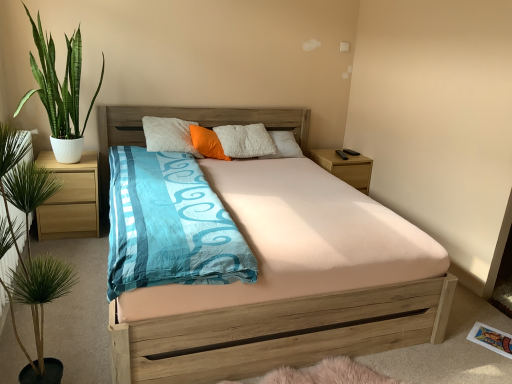
Question: Is green leafy plant at left, which appears as the first houseplant when viewed from the front, positioned with its back to green glossy plant at left, the second houseplant when ordered from bottom to top?

Choices:
 (A) yes
 (B) no

Answer: (B)

Question: Does green leafy plant at left, which ranks as the 1th houseplant in bottom-to-top order, come in front of green glossy plant at left, marked as the 2th houseplant in a front-to-back arrangement?

Choices:
 (A) no
 (B) yes

Answer: (B)

Question: Does green leafy plant at left, which ranks as the 1th houseplant in bottom-to-top order, have a larger size compared to green glossy plant at left, marked as the 2th houseplant in a front-to-back arrangement?

Choices:
 (A) yes
 (B) no

Answer: (B)

Question: Can you confirm if green leafy plant at left, which is the 2th houseplant in top-to-bottom order, is thinner than green glossy plant at left, the second houseplant when ordered from bottom to top?

Choices:
 (A) no
 (B) yes

Answer: (B)

Question: Is green leafy plant at left, marked as the second houseplant in a back-to-front arrangement, in contact with green glossy plant at left, the second houseplant when ordered from bottom to top?

Choices:
 (A) no
 (B) yes

Answer: (A)

Question: Is green glossy plant at left, marked as the 2th houseplant in a front-to-back arrangement, completely or partially inside green leafy plant at left, which ranks as the 1th houseplant in bottom-to-top order?

Choices:
 (A) yes
 (B) no

Answer: (B)

Question: Is light brown wood at left, acting as the second nightstand starting from the right, to the left of orange soft pillow at center from the viewer's perspective?

Choices:
 (A) yes
 (B) no

Answer: (A)

Question: Is light brown wood at left, marked as the first nightstand in a left-to-right arrangement, taller than orange soft pillow at center?

Choices:
 (A) yes
 (B) no

Answer: (A)

Question: Does light brown wood at left, the first nightstand when ordered from front to back, come behind orange soft pillow at center?

Choices:
 (A) no
 (B) yes

Answer: (A)

Question: Is light brown wood at left, the first nightstand when ordered from front to back, outside orange soft pillow at center?

Choices:
 (A) no
 (B) yes

Answer: (B)

Question: Does light brown wood at left, the first nightstand when ordered from front to back, turn towards orange soft pillow at center?

Choices:
 (A) no
 (B) yes

Answer: (A)

Question: Is light brown wood at left, acting as the second nightstand starting from the right, looking in the opposite direction of orange soft pillow at center?

Choices:
 (A) no
 (B) yes

Answer: (A)

Question: Can you confirm if green glossy plant at left, which is the 1th houseplant in top-to-bottom order, is taller than wooden nightstand at right, which is the 1th nightstand in back-to-front order?

Choices:
 (A) yes
 (B) no

Answer: (A)